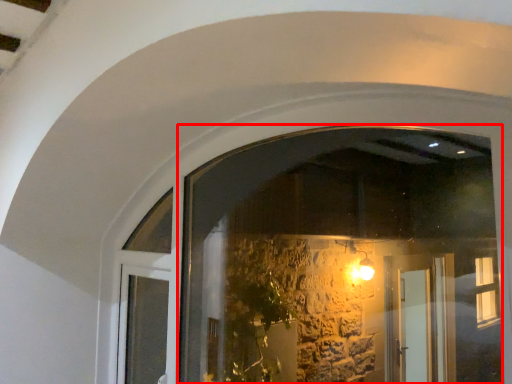
Question: Where is window (annotated by the red box) located in relation to door in the image?

Choices:
 (A) right
 (B) left

Answer: (A)